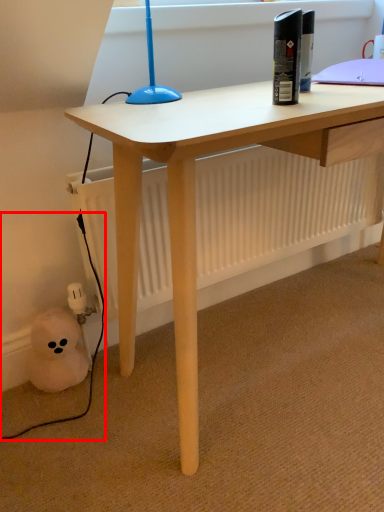
Question: From the image's perspective, where is cable (annotated by the red box) located relative to bottle?

Choices:
 (A) below
 (B) above

Answer: (A)